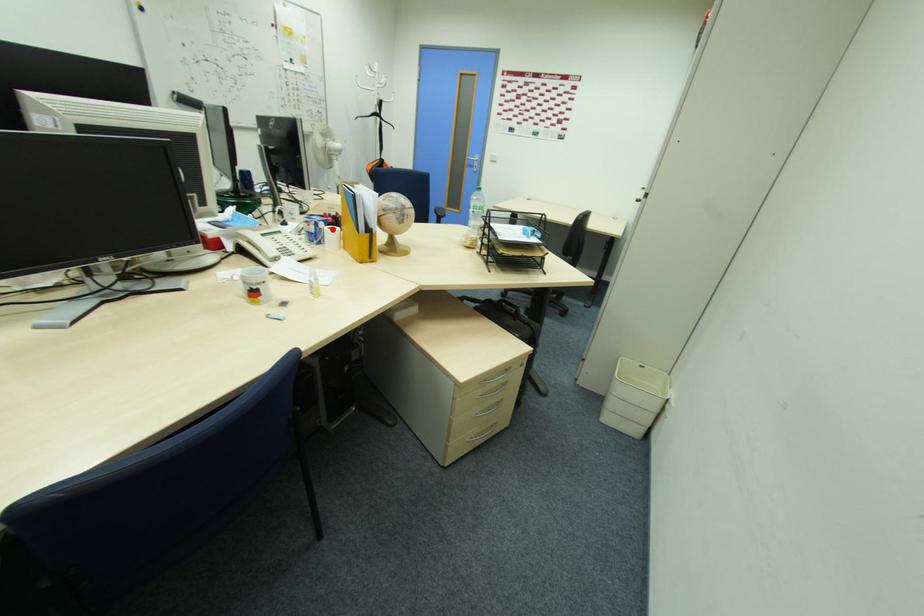
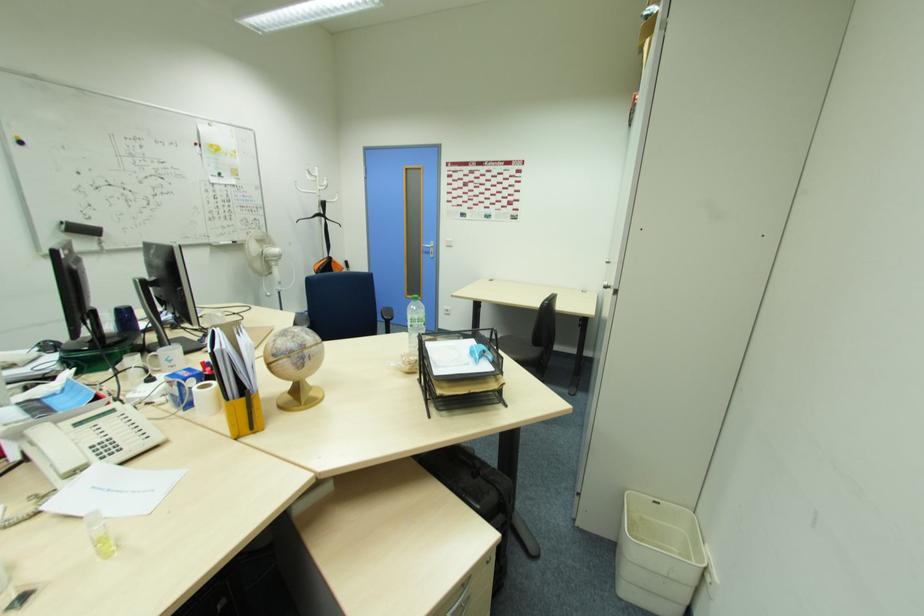
Where in the second image is the point corresponding to the highlighted location from the first image?

(204, 387)